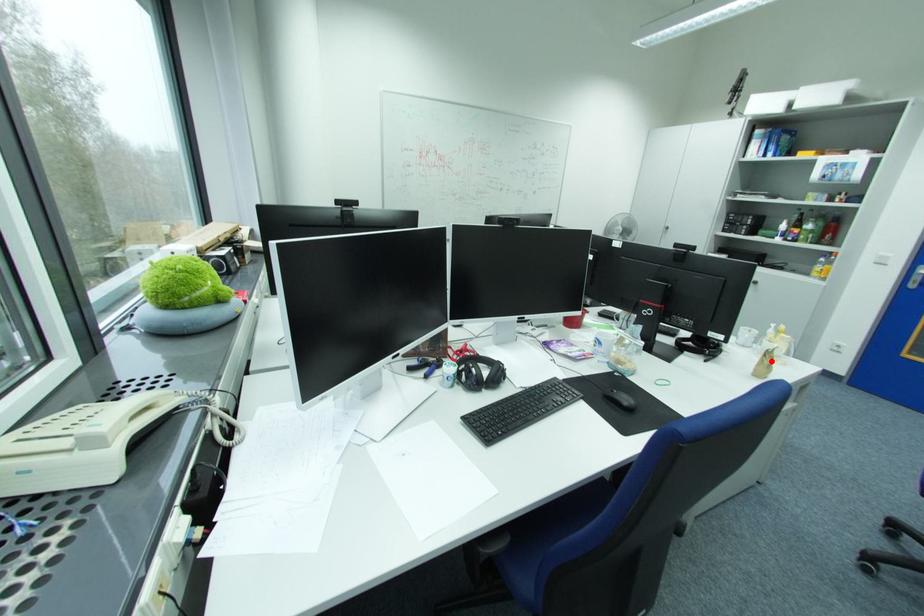
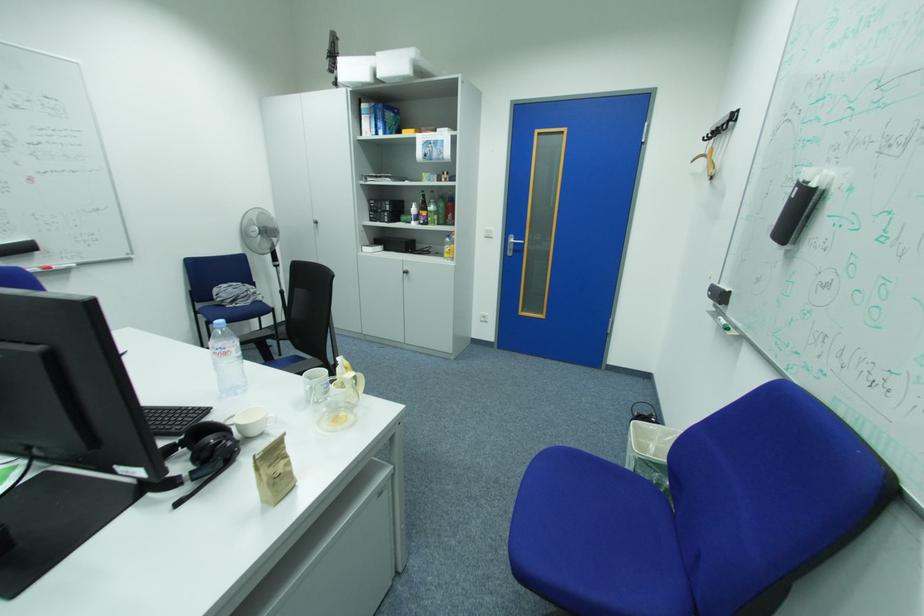
The point at the highlighted location is marked in the first image. Where is the corresponding point in the second image?

(268, 476)